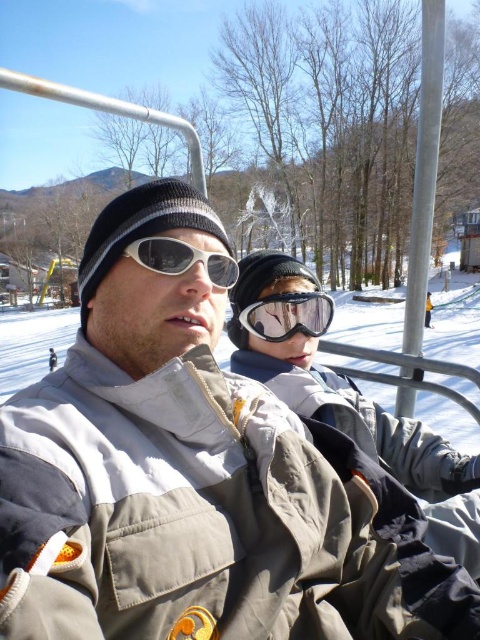
Is the position of transparent plastic goggles at center less distant than that of white matte goggles at center?

No, transparent plastic goggles at center is behind white matte goggles at center.

Does point (266, 296) lie in front of point (152, 266)?

No.

Locate an element on the screen. The width and height of the screenshot is (480, 640). transparent plastic goggles at center is located at coordinates click(x=288, y=316).